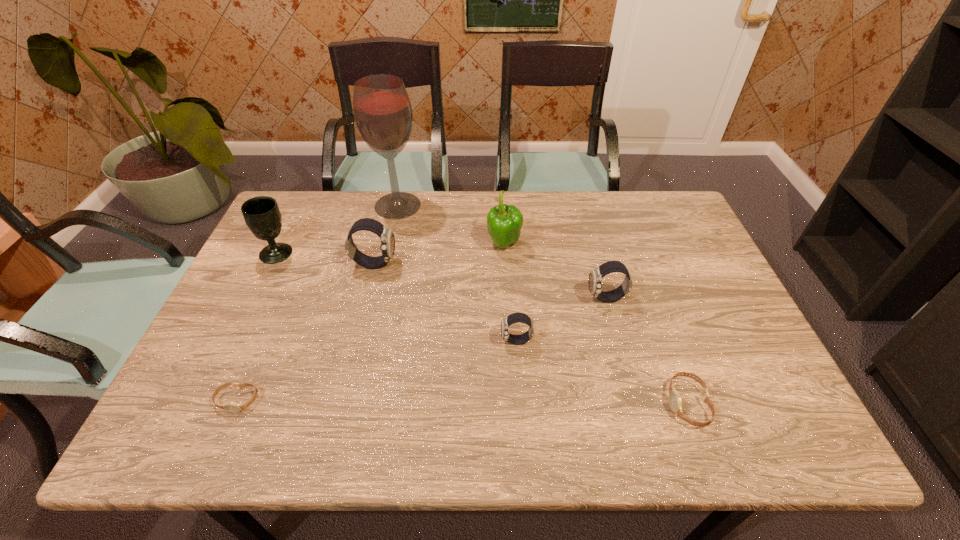
Locate which watch is the third closest to the third shortest watch. Please provide its 2D coordinates. Your answer should be formatted as a tuple, i.e. [(x, y)], where the tuple contains the x and y coordinates of a point satisfying the conditions above.

[(387, 240)]

At what (x,y) coordinates should I click in order to perform the action: click on dark watch object that ranks as the closest to the third shortest watch. Please return your answer as a coordinate pair (x, y). Looking at the image, I should click on (x=596, y=275).

Where is `dark watch that can be found as the closest to the fifth shortest object`? The width and height of the screenshot is (960, 540). dark watch that can be found as the closest to the fifth shortest object is located at coordinates pos(513,318).

At what (x,y) coordinates should I click in order to perform the action: click on free space that satisfies the following two spatial constraints: 1. on the back side of the chalice; 2. on the right side of the bell pepper. Please return your answer as a coordinate pair (x, y). Looking at the image, I should click on (280, 245).

Identify the location of vacant position in the image that satisfies the following two spatial constraints: 1. on the front side of the alcohol; 2. on the face of the tallest watch. (385, 264).

The width and height of the screenshot is (960, 540). Find the location of `free space that satisfies the following two spatial constraints: 1. on the face of the farthest watch; 2. on the face of the shortest watch`. free space that satisfies the following two spatial constraints: 1. on the face of the farthest watch; 2. on the face of the shortest watch is located at coordinates (341, 400).

The image size is (960, 540). What are the coordinates of `vacant space that satisfies the following two spatial constraints: 1. on the face of the fifth farthest object; 2. on the face of the leftmost watch` in the screenshot? It's located at (634, 400).